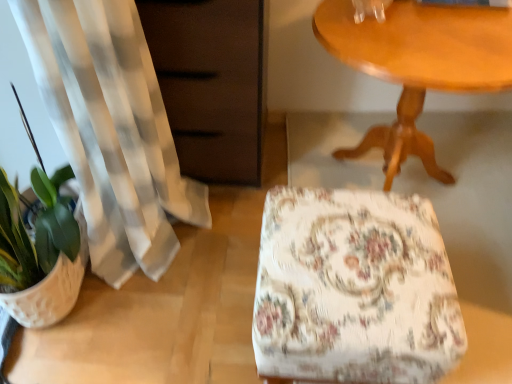
Question: Is floral fabric ottoman at center thinner than matte brown dresser at left?

Choices:
 (A) yes
 (B) no

Answer: (A)

Question: Could you tell me if floral fabric ottoman at center is facing matte brown dresser at left?

Choices:
 (A) yes
 (B) no

Answer: (B)

Question: Is floral fabric ottoman at center to the left of matte brown dresser at left from the viewer's perspective?

Choices:
 (A) yes
 (B) no

Answer: (B)

Question: Is floral fabric ottoman at center facing away from matte brown dresser at left?

Choices:
 (A) no
 (B) yes

Answer: (A)

Question: Is the depth of floral fabric ottoman at center greater than that of matte brown dresser at left?

Choices:
 (A) yes
 (B) no

Answer: (B)

Question: Is white textured flowerpot at lower left inside or outside of matte brown dresser at left?

Choices:
 (A) inside
 (B) outside

Answer: (B)

Question: From a real-world perspective, is white textured flowerpot at lower left above or below matte brown dresser at left?

Choices:
 (A) above
 (B) below

Answer: (B)

Question: Is point (74, 263) closer or farther from the camera than point (227, 77)?

Choices:
 (A) closer
 (B) farther

Answer: (A)

Question: Looking at their shapes, would you say white textured flowerpot at lower left is wider or thinner than matte brown dresser at left?

Choices:
 (A) wide
 (B) thin

Answer: (B)

Question: Considering the positions of wooden table at upper right and matte brown dresser at left in the image, is wooden table at upper right wider or thinner than matte brown dresser at left?

Choices:
 (A) wide
 (B) thin

Answer: (A)

Question: Does point (497, 46) appear closer or farther from the camera than point (164, 13)?

Choices:
 (A) farther
 (B) closer

Answer: (B)

Question: From the image's perspective, relative to matte brown dresser at left, is wooden table at upper right above or below?

Choices:
 (A) below
 (B) above

Answer: (A)

Question: Considering their positions, is wooden table at upper right located in front of or behind matte brown dresser at left?

Choices:
 (A) front
 (B) behind

Answer: (A)

Question: Looking at their shapes, would you say matte brown dresser at left is wider or thinner than floral fabric ottoman at center?

Choices:
 (A) thin
 (B) wide

Answer: (B)

Question: From the image's perspective, is matte brown dresser at left located above or below floral fabric ottoman at center?

Choices:
 (A) above
 (B) below

Answer: (A)